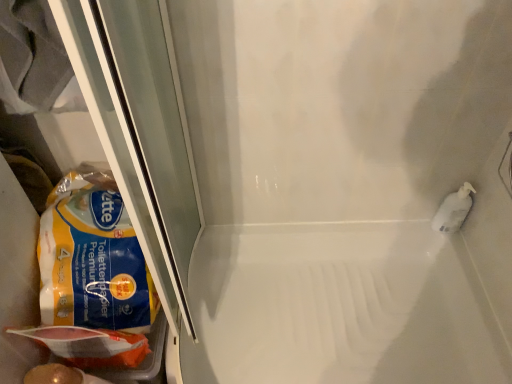
Question: Does white glossy bath at center have a greater height compared to matte plastic bag at lower left?

Choices:
 (A) yes
 (B) no

Answer: (B)

Question: From a real-world perspective, is white glossy bath at center on top of matte plastic bag at lower left?

Choices:
 (A) no
 (B) yes

Answer: (A)

Question: Is white glossy bath at center closer to the viewer compared to matte plastic bag at lower left?

Choices:
 (A) no
 (B) yes

Answer: (A)

Question: Is white glossy bath at center oriented away from matte plastic bag at lower left?

Choices:
 (A) no
 (B) yes

Answer: (A)

Question: Is white glossy bath at center at the left side of matte plastic bag at lower left?

Choices:
 (A) yes
 (B) no

Answer: (B)

Question: From a real-world perspective, is white glossy bath at center physically below matte plastic bag at lower left?

Choices:
 (A) yes
 (B) no

Answer: (A)

Question: From the image's perspective, is white glossy bath at center above yellow matte paper towel at left?

Choices:
 (A) no
 (B) yes

Answer: (A)

Question: Are white glossy bath at center and yellow matte paper towel at left making contact?

Choices:
 (A) yes
 (B) no

Answer: (B)

Question: Is white glossy bath at center thinner than yellow matte paper towel at left?

Choices:
 (A) no
 (B) yes

Answer: (A)

Question: From a real-world perspective, is white glossy bath at center physically above yellow matte paper towel at left?

Choices:
 (A) yes
 (B) no

Answer: (B)

Question: Does white glossy bath at center appear on the left side of yellow matte paper towel at left?

Choices:
 (A) no
 (B) yes

Answer: (A)

Question: Does white glossy bath at center have a larger size compared to yellow matte paper towel at left?

Choices:
 (A) no
 (B) yes

Answer: (B)

Question: Is yellow matte paper towel at left far away from matte plastic bag at lower left?

Choices:
 (A) no
 (B) yes

Answer: (A)